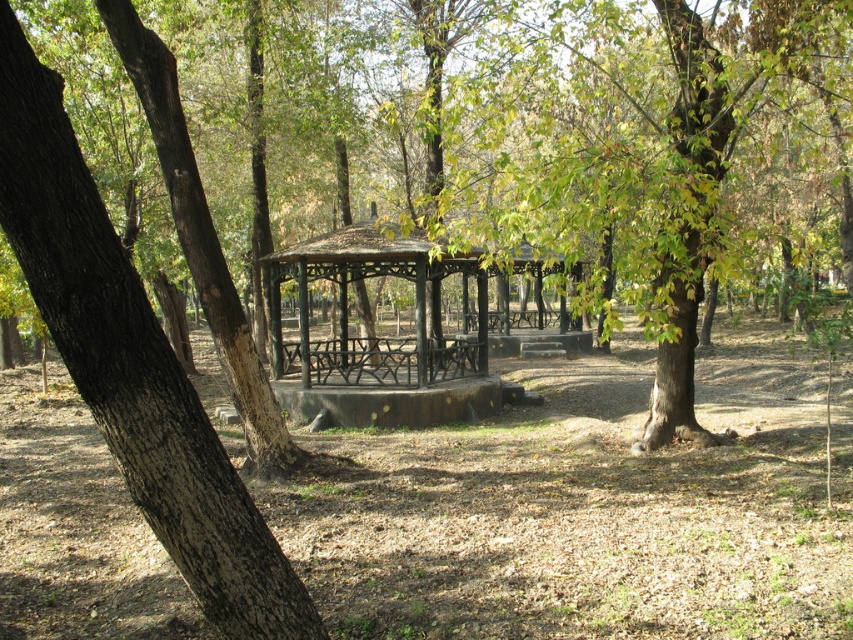
Question: Which object is farther from the camera taking this photo?

Choices:
 (A) rustic wood gazebo at center
 (B) brown rough bark tree at left

Answer: (A)

Question: From the image, what is the correct spatial relationship of brown wood tree at center in relation to rustic wood gazebo at center?

Choices:
 (A) left
 (B) right

Answer: (B)

Question: Which object appears farthest from the camera in this image?

Choices:
 (A) brown wood tree at center
 (B) rustic wood gazebo at center
 (C) brown rough bark tree at left

Answer: (B)

Question: Does brown wood tree at center have a lesser width compared to rustic wood gazebo at center?

Choices:
 (A) no
 (B) yes

Answer: (A)

Question: Based on their relative distances, which object is nearer to the brown wood tree at center?

Choices:
 (A) rustic wood gazebo at center
 (B) brown rough bark tree at left

Answer: (A)

Question: Can you confirm if brown rough bark tree at left is wider than rustic wood gazebo at center?

Choices:
 (A) no
 (B) yes

Answer: (A)